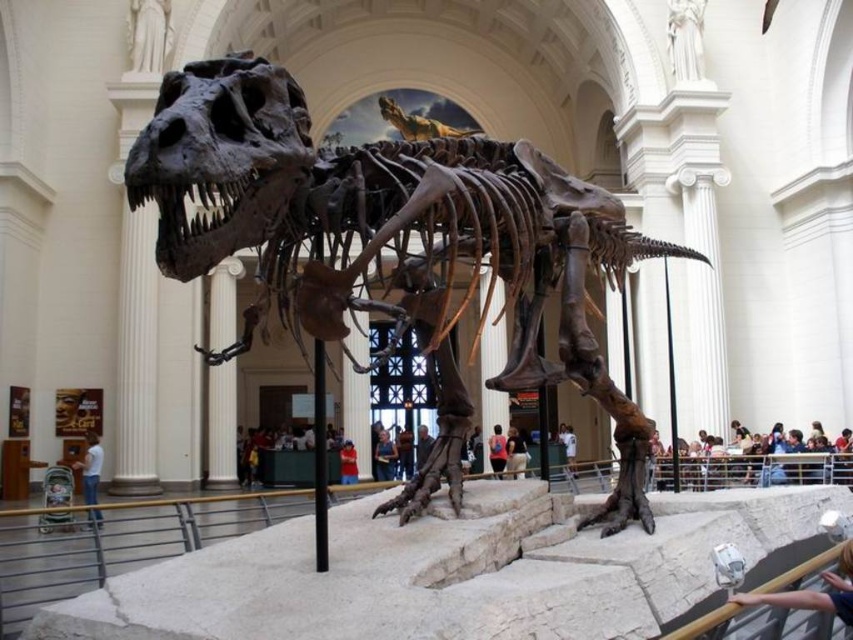
Is point (224, 225) behind point (798, 470)?

That is False.

Does rusty metallic skeleton at center appear over light brown wooden bench at lower right?

Yes.

Is point (439, 202) less distant than point (683, 481)?

Yes.

You are a GUI agent. You are given a task and a screenshot of the screen. Output one action in this format:
    pyautogui.click(x=<x>, y=<y>)
    Task: Click on the rusty metallic skeleton at center
    
    Given the screenshot: What is the action you would take?
    pyautogui.click(x=389, y=243)

Identify the location of denim jacket at center. (347, 461).

Which is behind, point (355, 477) or point (560, 442)?

The point (560, 442) is more distant.

Where is `denim jacket at center`? This screenshot has width=853, height=640. denim jacket at center is located at coordinates (347, 461).

Who is positioned more to the left, rusty metallic skeleton at center or pink fabric shirt at center?

rusty metallic skeleton at center

Is point (450, 468) more distant than point (490, 458)?

No, it is not.

Where is `rusty metallic skeleton at center`? rusty metallic skeleton at center is located at coordinates (389, 243).